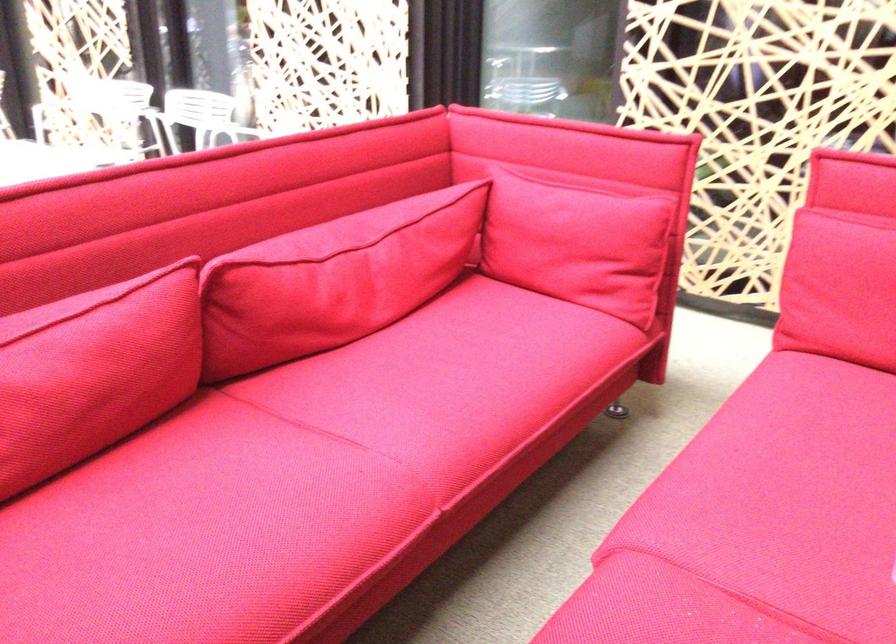
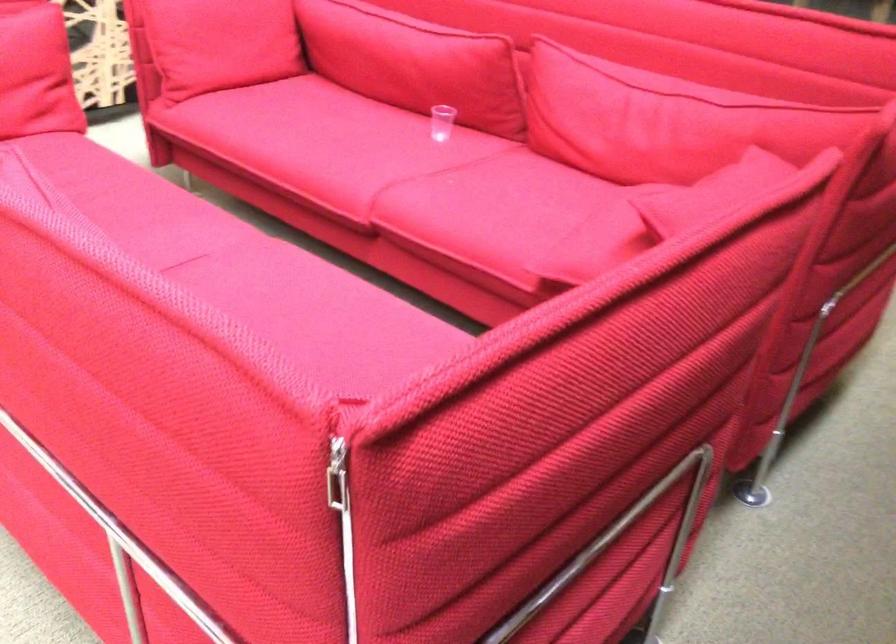
The point at (x=312, y=468) is marked in the first image. Where is the corresponding point in the second image?

(244, 270)